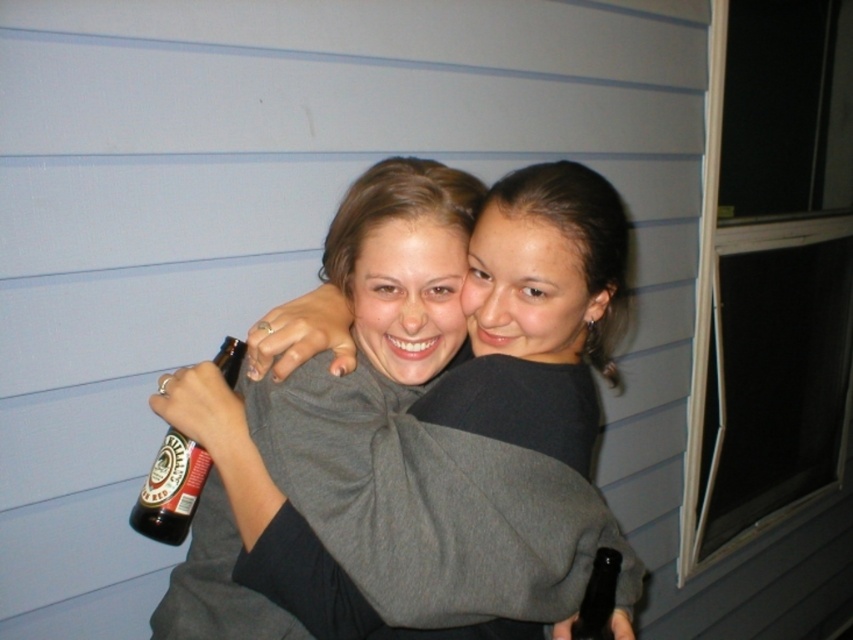
Can you confirm if brown glass beer bottle at lower left is thinner than dark brown glass bottle at center?

No, brown glass beer bottle at lower left is not thinner than dark brown glass bottle at center.

Between point (167, 528) and point (590, 572), which one is positioned in front?

Point (590, 572)

Where is `brown glass beer bottle at lower left`? The width and height of the screenshot is (853, 640). brown glass beer bottle at lower left is located at coordinates (170, 490).

Can you confirm if gray soft sweater at center is positioned to the right of brown glass beer bottle at lower left?

Indeed, gray soft sweater at center is positioned on the right side of brown glass beer bottle at lower left.

Between point (512, 529) and point (157, 486), which one is positioned in front?

Positioned in front is point (512, 529).

The image size is (853, 640). What do you see at coordinates (532, 381) in the screenshot?
I see `gray soft sweater at center` at bounding box center [532, 381].

Where is `gray soft sweater at center`? The image size is (853, 640). gray soft sweater at center is located at coordinates (532, 381).

Can you confirm if gray soft sweater at center is positioned above dark brown glass bottle at center?

Indeed, gray soft sweater at center is positioned over dark brown glass bottle at center.

Who is positioned more to the right, gray soft sweater at center or dark brown glass bottle at center?

dark brown glass bottle at center

Which is in front, point (283, 600) or point (601, 563)?

Point (601, 563) is in front.

Find the location of `gray soft sweater at center`. gray soft sweater at center is located at coordinates (532, 381).